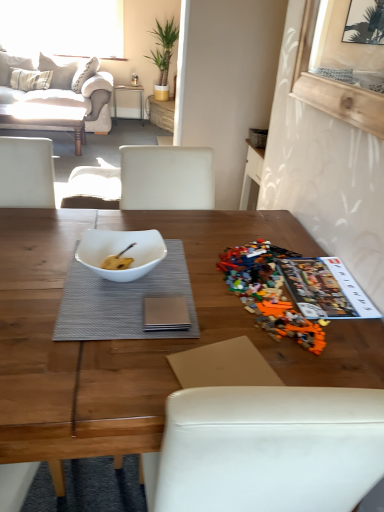
Identify the location of vacant area that is in front of white glossy bowl at center. The width and height of the screenshot is (384, 512). (97, 329).